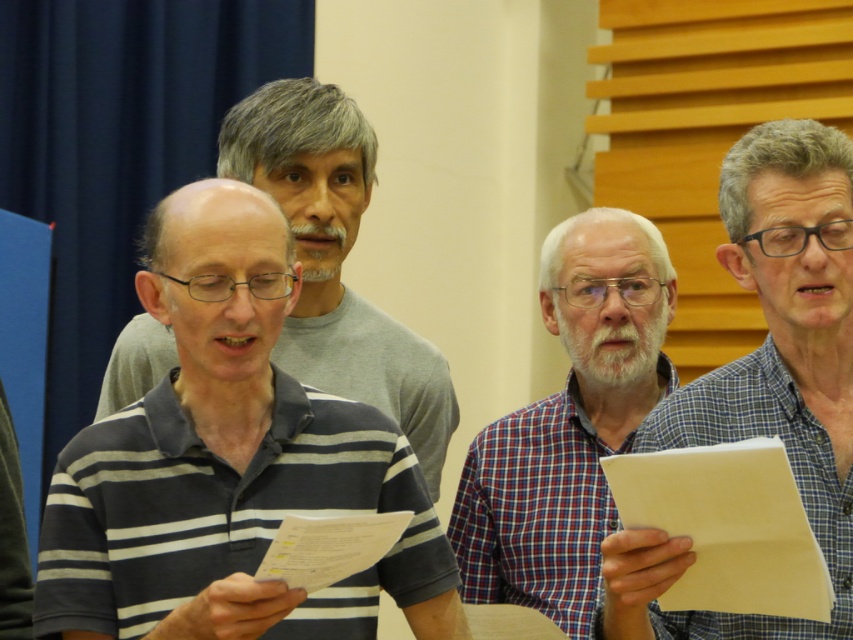
Is point (630, 493) closer to viewer compared to point (343, 566)?

No.

Between point (798, 504) and point (317, 554), which one is positioned behind?

The point (317, 554) is more distant.

The width and height of the screenshot is (853, 640). In order to click on yellow paper at lower right in this screenshot , I will do `click(727, 525)`.

Does striped cotton shirt at center come in front of yellow paper at lower right?

No, striped cotton shirt at center is behind yellow paper at lower right.

What do you see at coordinates (335, 259) in the screenshot? I see `striped cotton shirt at center` at bounding box center [335, 259].

The image size is (853, 640). Find the location of `striped cotton shirt at center`. striped cotton shirt at center is located at coordinates (335, 259).

Can you confirm if blue plaid shirt at center is bigger than striped cotton shirt at center?

No, blue plaid shirt at center is not bigger than striped cotton shirt at center.

Can you confirm if blue plaid shirt at center is positioned above striped cotton shirt at center?

Actually, blue plaid shirt at center is below striped cotton shirt at center.

The image size is (853, 640). I want to click on blue plaid shirt at center, so click(x=767, y=376).